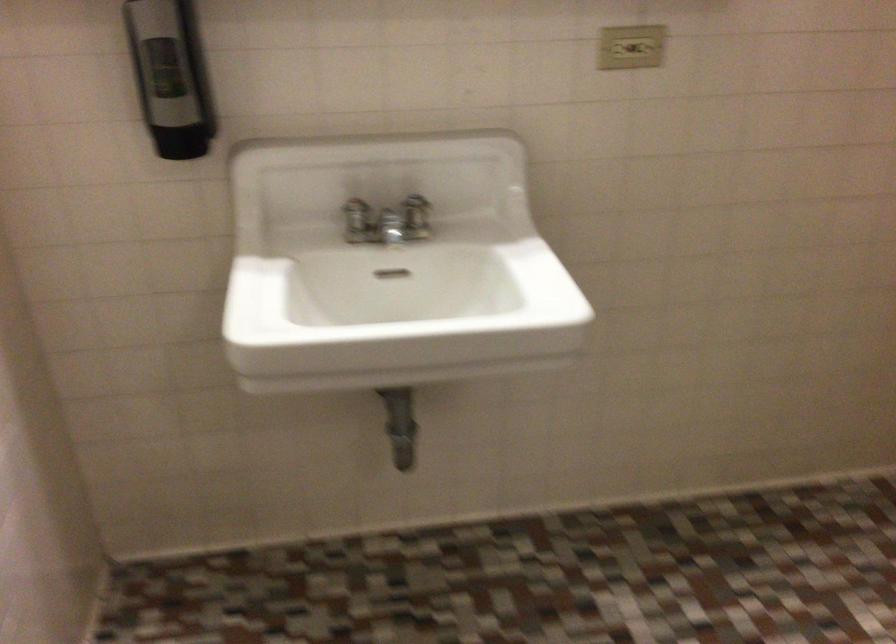
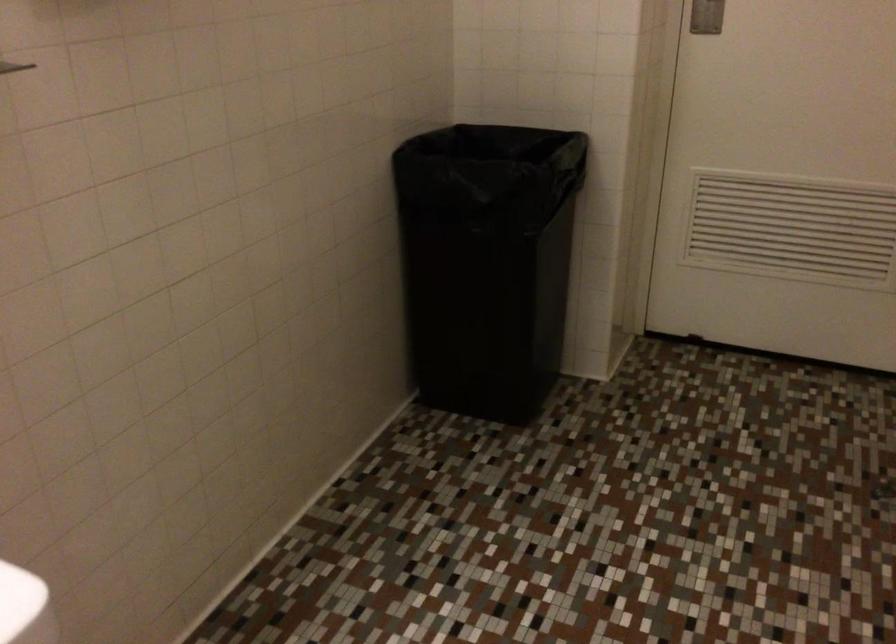
Question: The camera is either moving clockwise (left) or counter-clockwise (right) around the object. The first image is from the beginning of the video and the second image is from the end. Is the camera moving left or right when shooting the video?

Choices:
 (A) Left
 (B) Right

Answer: (A)